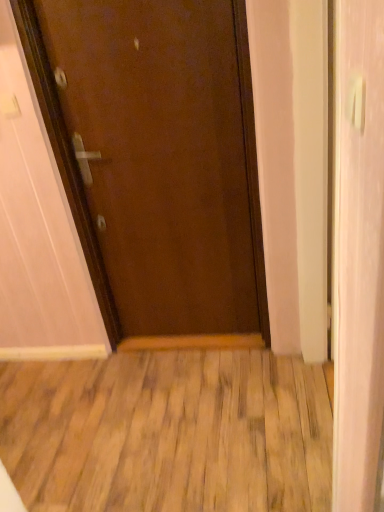
This screenshot has width=384, height=512. What are the coordinates of `vacant area situated below white glossy door at right (from a real-world perspective)` in the screenshot? It's located at (323, 411).